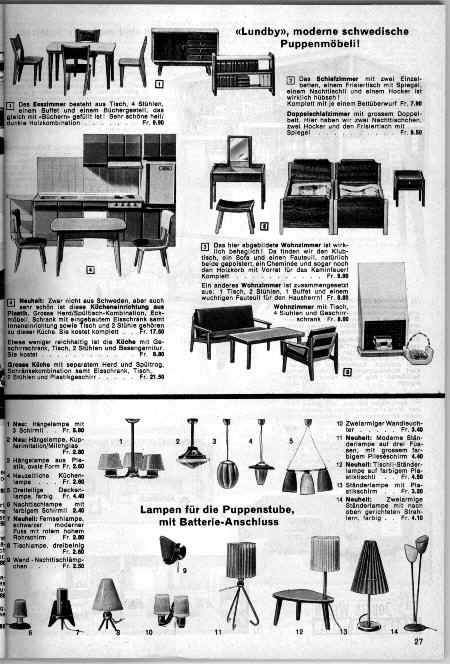
Identify the location of book cases. (190, 30), (244, 56).